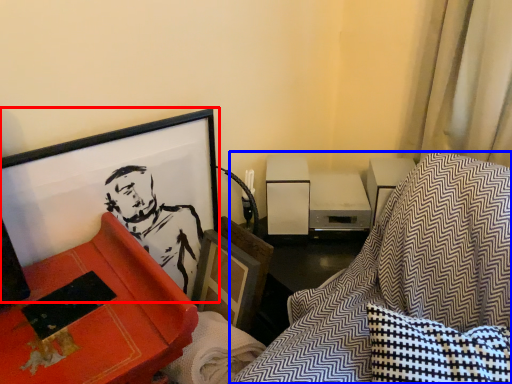
Question: Which point is closer to the camera, picture frame (highlighted by a red box) or swivel chair (highlighted by a blue box)?

Choices:
 (A) picture frame
 (B) swivel chair

Answer: (B)